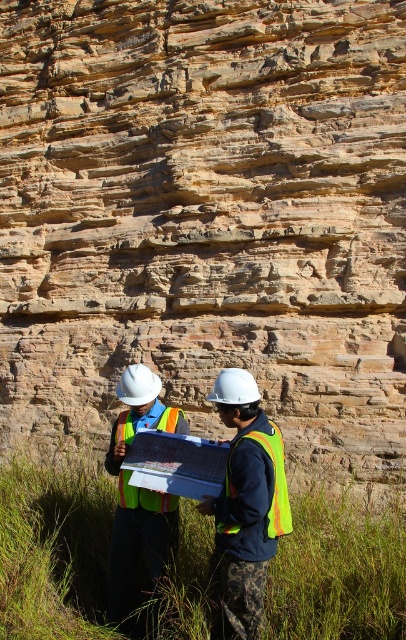
Question: Can you confirm if reflective yellow vest at center is positioned below reflective safety vest at center?

Choices:
 (A) yes
 (B) no

Answer: (B)

Question: Which point is closer to the camera taking this photo?

Choices:
 (A) (280, 502)
 (B) (148, 497)

Answer: (A)

Question: Is the position of reflective yellow vest at center less distant than that of reflective safety vest at center?

Choices:
 (A) yes
 (B) no

Answer: (B)

Question: Among these points, which one is farthest from the camera?

Choices:
 (A) (136, 374)
 (B) (203, 497)
 (C) (291, 524)
 (D) (129, 454)

Answer: (A)

Question: Among these points, which one is farthest from the camera?

Choices:
 (A) (222, 419)
 (B) (276, 493)

Answer: (A)

Question: Observing the image, what is the correct spatial positioning of reflective yellow vest at center in reference to high visibility fabric safety vest at lower right?

Choices:
 (A) right
 (B) left

Answer: (B)